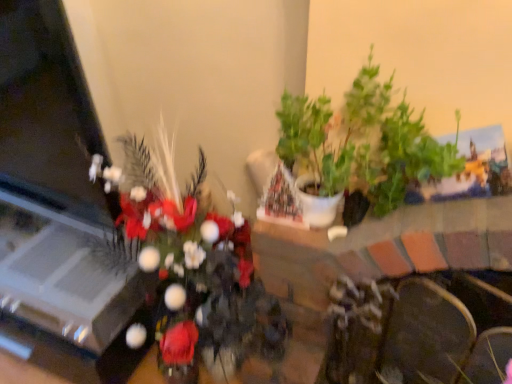
Question: Considering their positions, is velvet dark brown armchair at lower right located in front of or behind green leafy plant at center, positioned as the second houseplant in right-to-left order?

Choices:
 (A) front
 (B) behind

Answer: (B)

Question: Is velvet dark brown armchair at lower right wider or thinner than green leafy plant at center, positioned as the second houseplant in right-to-left order?

Choices:
 (A) wide
 (B) thin

Answer: (B)

Question: Which of these objects is positioned farthest from the velvet dark brown armchair at lower right?

Choices:
 (A) green matte plant at upper right, marked as the 2th houseplant in a left-to-right arrangement
 (B) green leafy plant at center, the first houseplant when ordered from left to right

Answer: (B)

Question: Which object is positioned farthest from the green matte plant at upper right, marked as the 2th houseplant in a left-to-right arrangement?

Choices:
 (A) green leafy plant at center, the first houseplant when ordered from left to right
 (B) velvet dark brown armchair at lower right

Answer: (A)